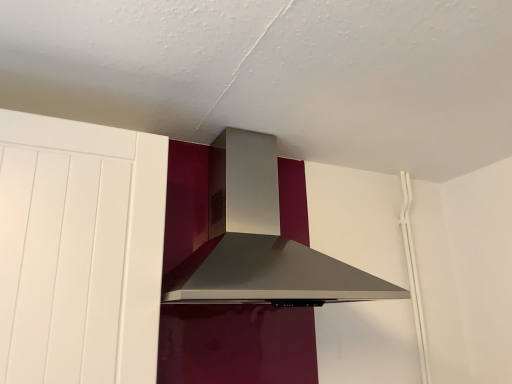
The height and width of the screenshot is (384, 512). Find the location of `vacant region above satin gray range hood at center (from a real-world perspective)`. vacant region above satin gray range hood at center (from a real-world perspective) is located at coordinates (265, 114).